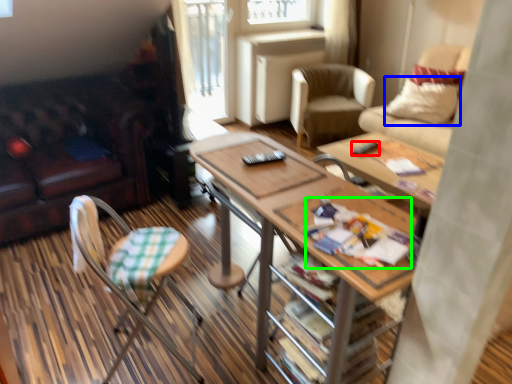
Question: Which object is the closest to the remote control (highlighted by a red box)? Choose among these: pillow (highlighted by a blue box) or magazine (highlighted by a green box).

Choices:
 (A) pillow
 (B) magazine

Answer: (A)